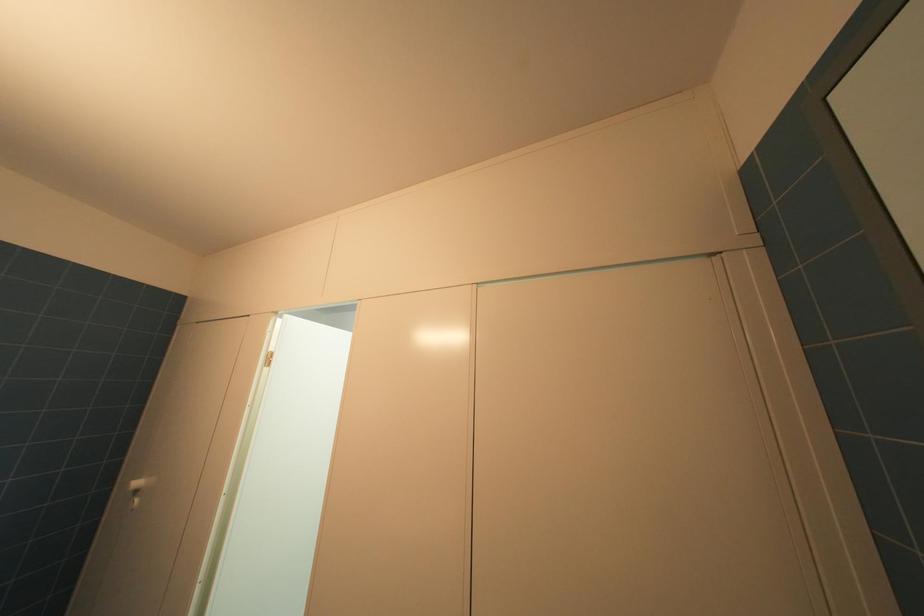
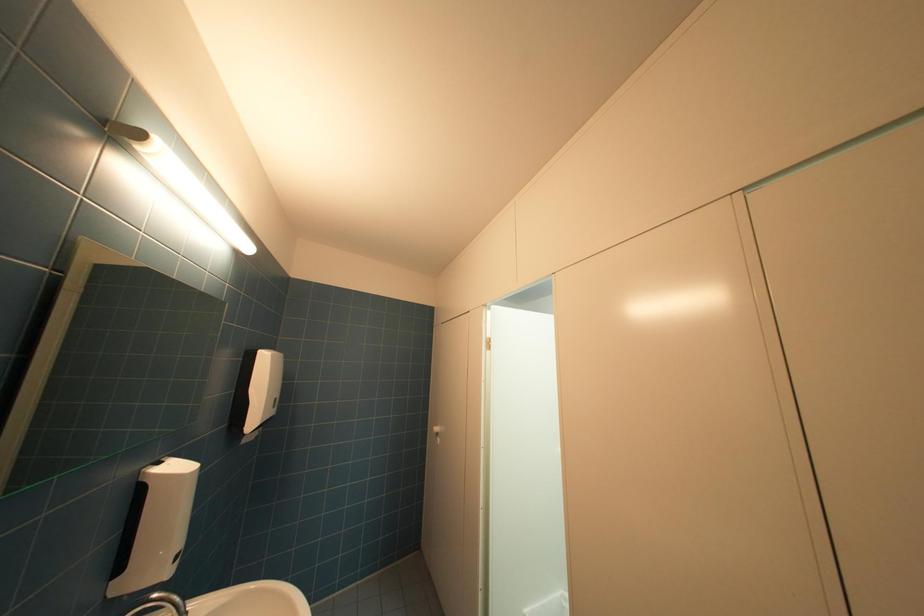
Question: Based on the continuous images, in which direction is the camera rotating? Reply with the corresponding letter.

Choices:
 (A) Left
 (B) Right
 (C) Up
 (D) Down

Answer: (A)